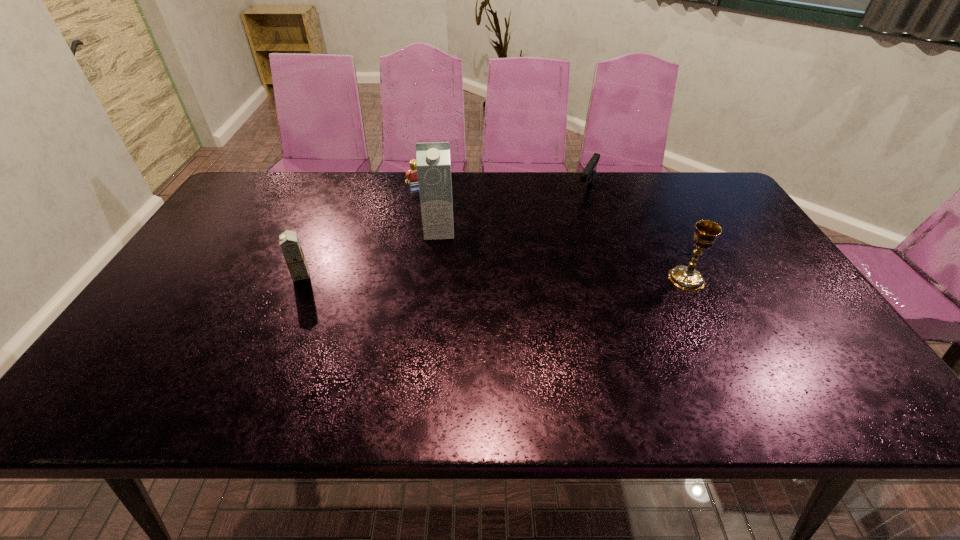
Identify the location of vacant point located 0.140m on the front-facing side of the fourth object from left to right. The width and height of the screenshot is (960, 540). (570, 225).

Where is `blank area located on the front-facing side of the fourth object from left to right`? blank area located on the front-facing side of the fourth object from left to right is located at coordinates (579, 210).

I want to click on blank space located 0.240m on the front-facing side of the fourth object from left to right, so click(x=560, y=244).

Find the location of a particular element. The width and height of the screenshot is (960, 540). free location located on the front-facing side of the second object from left to right is located at coordinates (441, 245).

The width and height of the screenshot is (960, 540). Find the location of `free space located on the front-facing side of the second object from left to right`. free space located on the front-facing side of the second object from left to right is located at coordinates (438, 239).

Image resolution: width=960 pixels, height=540 pixels. I want to click on vacant space located on the front-facing side of the second object from left to right, so click(431, 221).

Image resolution: width=960 pixels, height=540 pixels. What are the coordinates of `free location located on the front label of the third farthest object` in the screenshot? It's located at (440, 251).

I want to click on free space located on the front label of the third farthest object, so click(x=439, y=296).

In order to click on vacant space situated 0.160m on the front label of the third farthest object in this screenshot , I will do `click(439, 278)`.

Image resolution: width=960 pixels, height=540 pixels. I want to click on pistol that is at the far edge, so click(588, 174).